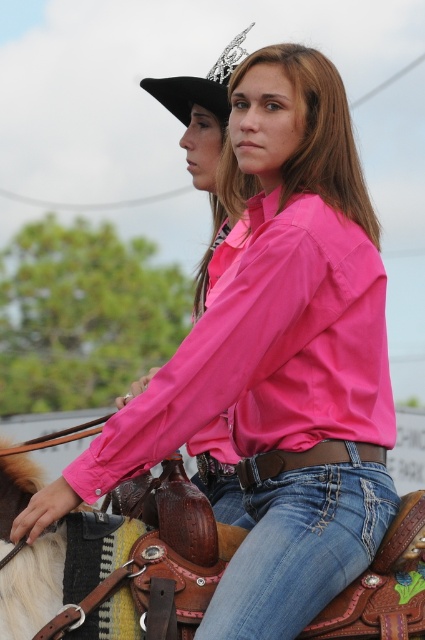
Question: Which of these objects is positioned closest to the black felt cowboy hat at upper left?

Choices:
 (A) denim at center
 (B) brown leather saddle at lower center

Answer: (B)

Question: Which of the following is the closest to the observer?

Choices:
 (A) denim at center
 (B) brown leather saddle at lower center
 (C) black felt cowboy hat at upper left

Answer: (A)

Question: Which is farther from the black felt cowboy hat at upper left?

Choices:
 (A) denim at center
 (B) brown leather saddle at lower center

Answer: (A)

Question: Is brown leather saddle at lower center below denim at center?

Choices:
 (A) yes
 (B) no

Answer: (B)

Question: Does brown leather saddle at lower center have a smaller size compared to denim at center?

Choices:
 (A) no
 (B) yes

Answer: (A)

Question: Is brown leather saddle at lower center positioned at the back of denim at center?

Choices:
 (A) yes
 (B) no

Answer: (A)